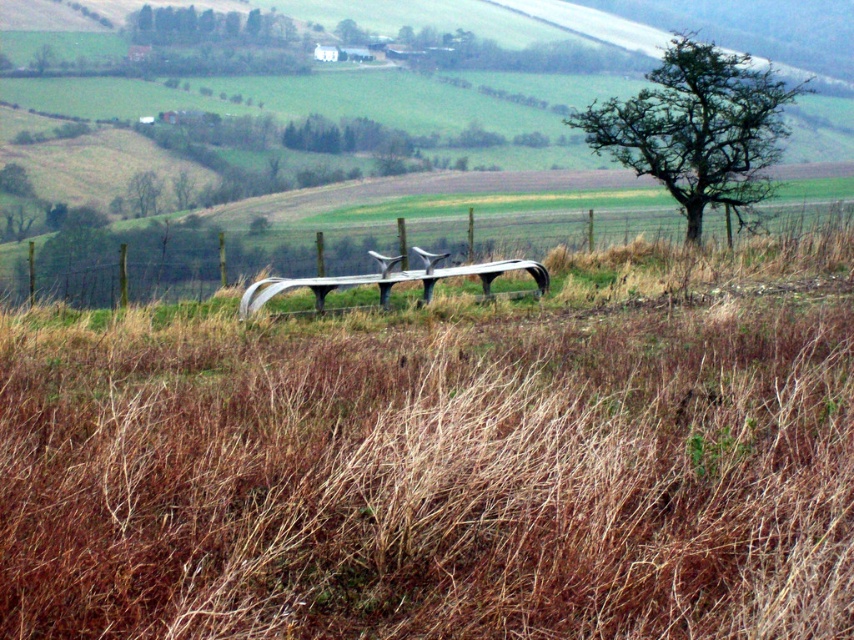
Question: In this image, where is metal wire fence at center located relative to green leafy tree at upper right?

Choices:
 (A) above
 (B) below

Answer: (B)

Question: Which is farther from the metal wire fence at center?

Choices:
 (A) green leafy tree at upper right
 (B) green leafy tree at center

Answer: (B)

Question: Does metal wire fence at center appear on the left side of green leafy tree at upper right?

Choices:
 (A) no
 (B) yes

Answer: (B)

Question: Which object is the closest to the green leafy tree at center?

Choices:
 (A) metal wire fence at center
 (B) green leafy tree at upper right

Answer: (B)

Question: Which point is closer to the camera?

Choices:
 (A) green leafy tree at upper right
 (B) metal wire fence at center
 (C) green leafy tree at center

Answer: (B)

Question: Can you confirm if metal wire fence at center is positioned to the left of green leafy tree at center?

Choices:
 (A) no
 (B) yes

Answer: (A)